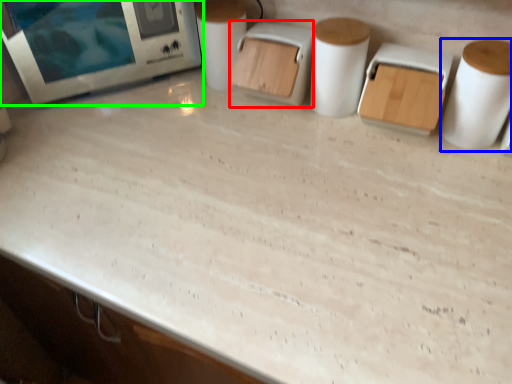
Question: Which object is positioned closest to appliance (highlighted by a red box)? Select from paper towel (highlighted by a blue box) and home appliance (highlighted by a green box).

Choices:
 (A) paper towel
 (B) home appliance

Answer: (B)